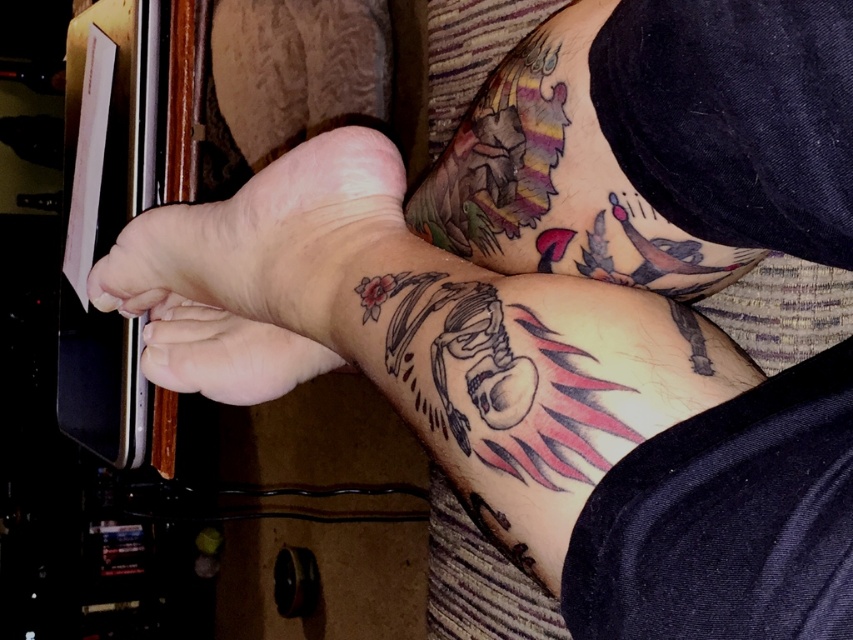
Question: Does skinsmoothhand at center have a greater width compared to matte skin at center?

Choices:
 (A) yes
 (B) no

Answer: (A)

Question: Can you confirm if skinsmoothhand at center is bigger than matte skin at center?

Choices:
 (A) no
 (B) yes

Answer: (B)

Question: Which of the following is the farthest from the observer?

Choices:
 (A) (303, 372)
 (B) (314, 301)

Answer: (A)

Question: Among these objects, which one is farthest from the camera?

Choices:
 (A) skinsmoothhand at center
 (B) matte skin at center

Answer: (B)

Question: Is skin at center to the right of skinsmoothhand at center from the viewer's perspective?

Choices:
 (A) no
 (B) yes

Answer: (B)

Question: Which point is closer to the camera?

Choices:
 (A) matte skin at center
 (B) skinsmoothhand at center
 (C) skin at center

Answer: (C)